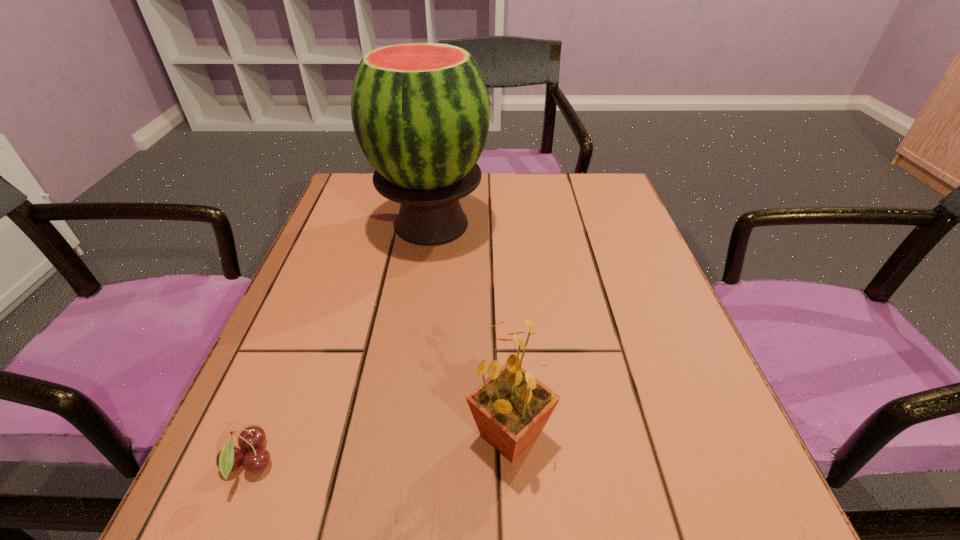
The image size is (960, 540). In order to click on the farthest object in this screenshot , I will do `click(420, 111)`.

This screenshot has height=540, width=960. Find the location of `watermelon`. watermelon is located at coordinates (420, 111).

This screenshot has width=960, height=540. I want to click on the second tallest object, so click(511, 407).

Locate an element on the screen. The width and height of the screenshot is (960, 540). the shortest object is located at coordinates (229, 459).

Identify the location of cherry. (229, 459).

I want to click on free space located 0.090m on the front of the watermelon, so click(421, 288).

What are the coordinates of `free space located 0.240m at the front of the sunflower with flowers visible` in the screenshot? It's located at (302, 434).

What are the coordinates of `vacant area situated 0.330m at the front of the sunflower with flowers visible` in the screenshot? It's located at (241, 434).

Find the location of `vacant space located at the front of the sunflower with flowers visible`. vacant space located at the front of the sunflower with flowers visible is located at coordinates pyautogui.click(x=248, y=434).

You are a GUI agent. You are given a task and a screenshot of the screen. Output one action in this format:
    pyautogui.click(x=<x>, y=<y>)
    Task: Click on the vacant space located on the leaves of the shortest object
    This screenshot has height=540, width=960.
    Given the screenshot: What is the action you would take?
    pos(447,462)